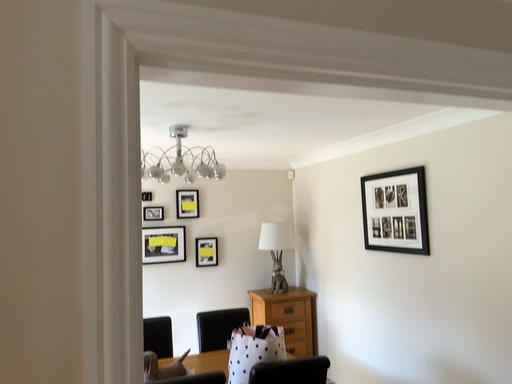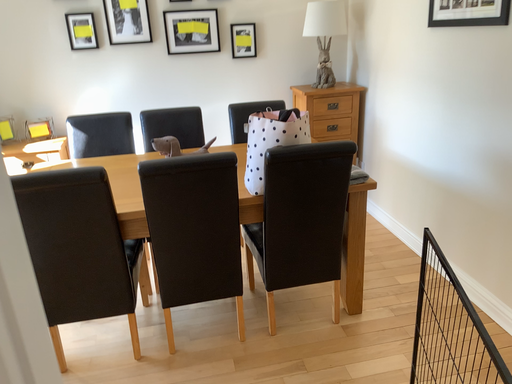
Question: How did the camera likely rotate when shooting the video?

Choices:
 (A) rotated right
 (B) rotated left

Answer: (B)